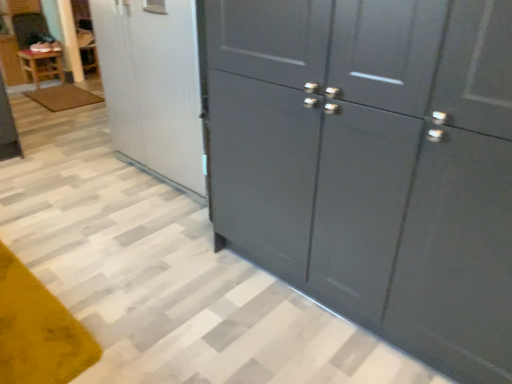
Question: Is glossy dark gray cupboard at right not inside white glossy refrigerator at upper left?

Choices:
 (A) yes
 (B) no

Answer: (A)

Question: Considering the relative sizes of glossy dark gray cupboard at right and white glossy refrigerator at upper left in the image provided, is glossy dark gray cupboard at right shorter than white glossy refrigerator at upper left?

Choices:
 (A) yes
 (B) no

Answer: (B)

Question: Is glossy dark gray cupboard at right thinner than white glossy refrigerator at upper left?

Choices:
 (A) no
 (B) yes

Answer: (B)

Question: Considering the relative positions of glossy dark gray cupboard at right and white glossy refrigerator at upper left in the image provided, is glossy dark gray cupboard at right to the left of white glossy refrigerator at upper left from the viewer's perspective?

Choices:
 (A) yes
 (B) no

Answer: (B)

Question: Does glossy dark gray cupboard at right have a larger size compared to white glossy refrigerator at upper left?

Choices:
 (A) yes
 (B) no

Answer: (A)

Question: Is glossy dark gray cupboard at right inside or outside of white glossy refrigerator at upper left?

Choices:
 (A) inside
 (B) outside

Answer: (B)

Question: Based on their sizes in the image, would you say glossy dark gray cupboard at right is bigger or smaller than white glossy refrigerator at upper left?

Choices:
 (A) big
 (B) small

Answer: (A)

Question: Is point click(x=420, y=278) closer or farther from the camera than point click(x=148, y=3)?

Choices:
 (A) closer
 (B) farther

Answer: (A)

Question: From the image's perspective, is glossy dark gray cupboard at right located above or below white glossy refrigerator at upper left?

Choices:
 (A) above
 (B) below

Answer: (B)

Question: From a real-world perspective, is wooden table at left positioned above or below glossy dark gray cupboard at right?

Choices:
 (A) above
 (B) below

Answer: (B)

Question: Is point (38, 64) closer or farther from the camera than point (480, 299)?

Choices:
 (A) farther
 (B) closer

Answer: (A)

Question: Is wooden table at left in front of or behind glossy dark gray cupboard at right in the image?

Choices:
 (A) front
 (B) behind

Answer: (B)

Question: Considering the positions of wooden table at left and glossy dark gray cupboard at right in the image, is wooden table at left taller or shorter than glossy dark gray cupboard at right?

Choices:
 (A) short
 (B) tall

Answer: (A)

Question: Is point (56, 74) closer or farther from the camera than point (32, 99)?

Choices:
 (A) closer
 (B) farther

Answer: (B)

Question: In the image, is wooden table at left on the left side or the right side of brown textured mat at lower left?

Choices:
 (A) left
 (B) right

Answer: (A)